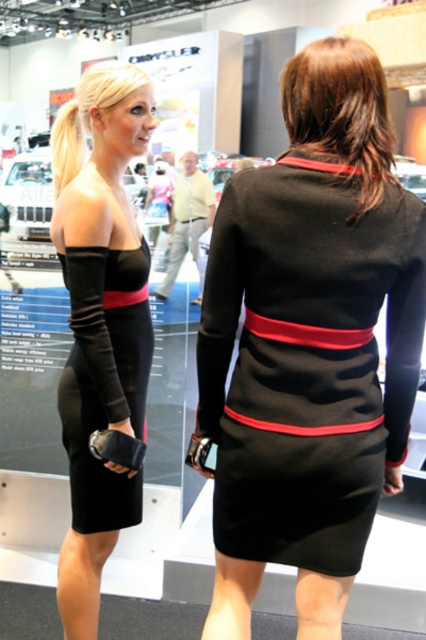
You are a fashion designer observing two outfits in the image. The first is the matte black dress at left, and the second is the yellow cotton shirt at center. Which outfit has a narrower silhouette?

The matte black dress at left has a narrower silhouette than the yellow cotton shirt at center because it is thinner.

You are a fashion designer observing two outfits at a car show. You see the black satin dress at center and the yellow cotton shirt at center. Which outfit is smaller in size?

The black satin dress at center has a smaller size compared to the yellow cotton shirt at center, so the black satin dress at center is the smaller one.

You are a photographer at a car show and want to focus on the two women standing at specific points. The first woman is at point [121,493] and the second is at point [199,273]. Which point is closer to your camera lens?

Point [121,493] is closer to the camera lens than point [199,273].